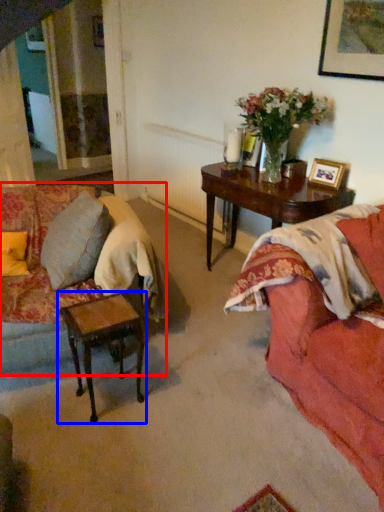
Question: Among these objects, which one is farthest to the camera, studio couch (highlighted by a red box) or table (highlighted by a blue box)?

Choices:
 (A) studio couch
 (B) table

Answer: (B)